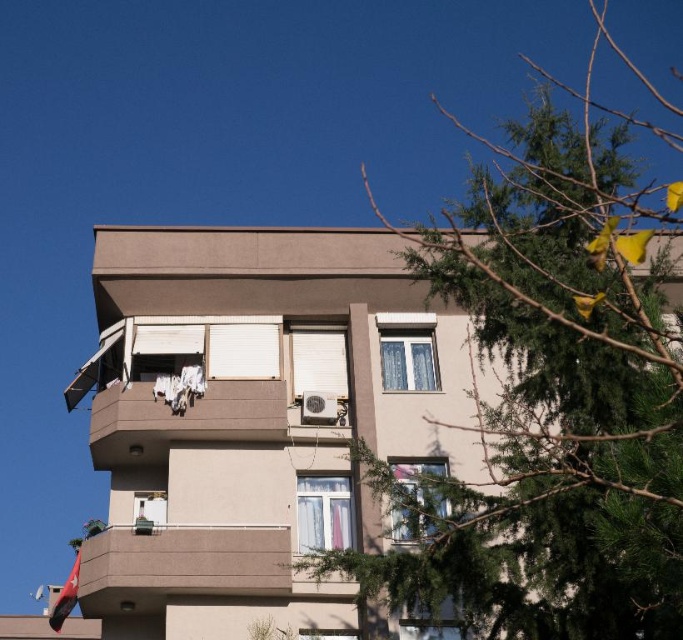
Question: Is smooth concrete balcony at lower center smaller than white sheer curtains at upper right?

Choices:
 (A) yes
 (B) no

Answer: (B)

Question: Can you confirm if smooth concrete balcony at lower center is wider than white sheer curtain at center?

Choices:
 (A) no
 (B) yes

Answer: (B)

Question: Considering the relative positions of transparent glass window at center and clear glass window at lower right in the image provided, where is transparent glass window at center located with respect to clear glass window at lower right?

Choices:
 (A) left
 (B) right

Answer: (A)

Question: Based on their relative distances, which object is farther from the transparent glass window at lower center?

Choices:
 (A) smooth concrete balcony at lower center
 (B) transparent glass window at center
 (C) white sheer curtain at center

Answer: (B)

Question: Which point is closer to the camera?

Choices:
 (A) white sheer curtains at upper right
 (B) smooth concrete balcony at lower center

Answer: (B)

Question: Which of the following is the farthest from the observer?

Choices:
 (A) (404, 525)
 (B) (682, 180)

Answer: (B)